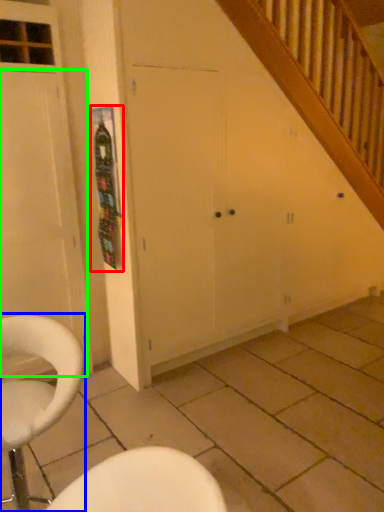
Question: Which object is the farthest from bulletin board (highlighted by a red box)? Choose among these: chair (highlighted by a blue box) or door (highlighted by a green box).

Choices:
 (A) chair
 (B) door

Answer: (A)